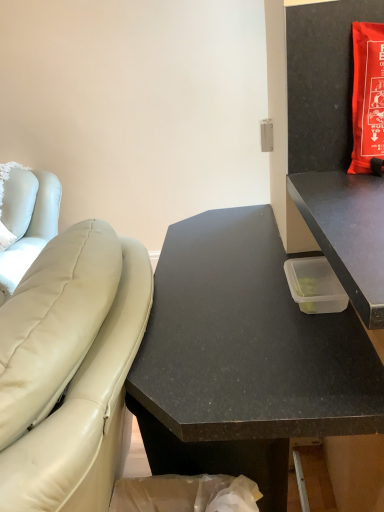
Where is `free location above black granite table at center (from a real-world perspective)`? The image size is (384, 512). free location above black granite table at center (from a real-world perspective) is located at coordinates (240, 278).